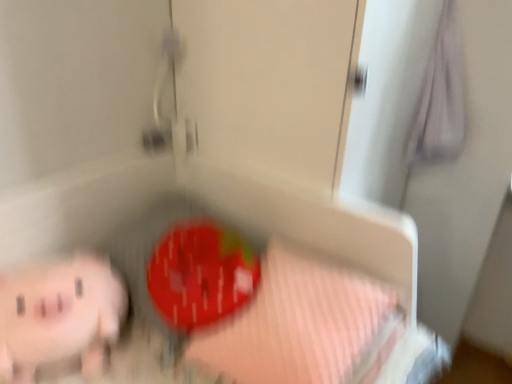
Measure the distance between pink striped fabric at lower center and camera.

pink striped fabric at lower center and camera are 31.44 inches apart from each other.

Describe the element at coordinates (304, 326) in the screenshot. I see `pink striped fabric at lower center` at that location.

Where is `pink striped fabric at lower center`? This screenshot has height=384, width=512. pink striped fabric at lower center is located at coordinates (304, 326).

What is the approximate width of pink striped fabric at lower center?

The width of pink striped fabric at lower center is 42.61 centimeters.

This screenshot has width=512, height=384. Describe the element at coordinates (59, 315) in the screenshot. I see `pink rubber piggy bank at lower left` at that location.

At what (x,y) coordinates should I click in order to perform the action: click on pink rubber piggy bank at lower left. Please return your answer as a coordinate pair (x, y). This screenshot has width=512, height=384. Looking at the image, I should click on (59, 315).

Identify the location of pink striped fabric at lower center. (304, 326).

Between pink striped fabric at lower center and pink rubber piggy bank at lower left, which one appears on the left side from the viewer's perspective?

From the viewer's perspective, pink rubber piggy bank at lower left appears more on the left side.

Which object is further away from the camera taking this photo, pink striped fabric at lower center or pink rubber piggy bank at lower left?

pink rubber piggy bank at lower left is further from the camera.

Which is closer, [378,330] or [88,277]?

The point [378,330] is in front.

From the image's perspective, which one is positioned higher, pink striped fabric at lower center or pink rubber piggy bank at lower left?

From the image's view, pink striped fabric at lower center is above.

From a real-world perspective, is pink striped fabric at lower center on pink rubber piggy bank at lower left?

Yes.

Between pink striped fabric at lower center and pink rubber piggy bank at lower left, which one has smaller width?

pink rubber piggy bank at lower left is thinner.

Considering the sizes of pink striped fabric at lower center and pink rubber piggy bank at lower left in the image, is pink striped fabric at lower center taller or shorter than pink rubber piggy bank at lower left?

In the image, pink striped fabric at lower center appears to be taller than pink rubber piggy bank at lower left.

Is pink striped fabric at lower center bigger or smaller than pink rubber piggy bank at lower left?

In the image, pink striped fabric at lower center appears to be larger than pink rubber piggy bank at lower left.

Is pink striped fabric at lower center inside the boundaries of pink rubber piggy bank at lower left, or outside?

pink striped fabric at lower center is located beyond the bounds of pink rubber piggy bank at lower left.

Is pink striped fabric at lower center in contact with pink rubber piggy bank at lower left?

No, pink striped fabric at lower center is not next to pink rubber piggy bank at lower left.

Is pink striped fabric at lower center aimed at pink rubber piggy bank at lower left?

No, pink striped fabric at lower center is not facing towards pink rubber piggy bank at lower left.

How different are the orientations of pink striped fabric at lower center and pink rubber piggy bank at lower left in degrees?

The angle between the facing direction of pink striped fabric at lower center and the facing direction of pink rubber piggy bank at lower left is 65.6 degrees.

Measure the distance between pink striped fabric at lower center and pink rubber piggy bank at lower left.

14.93 inches.

Find the location of a particular element. This screenshot has height=384, width=512. sheet in front of the pink rubber piggy bank at lower left is located at coordinates (304, 326).

Is pink rubber piggy bank at lower left at the right side of pink striped fabric at lower center?

Incorrect, pink rubber piggy bank at lower left is not on the right side of pink striped fabric at lower center.

Which object is further away from the camera taking this photo, pink rubber piggy bank at lower left or pink striped fabric at lower center?

pink rubber piggy bank at lower left is more distant.

Is point (65, 271) farther from camera compared to point (373, 333)?

Yes, it is.

From the image's perspective, does pink rubber piggy bank at lower left appear lower than pink striped fabric at lower center?

Yes.

From a real-world perspective, which is physically below, pink rubber piggy bank at lower left or pink striped fabric at lower center?

From a 3D spatial view, pink rubber piggy bank at lower left is below.

Considering the relative sizes of pink rubber piggy bank at lower left and pink striped fabric at lower center in the image provided, is pink rubber piggy bank at lower left wider than pink striped fabric at lower center?

In fact, pink rubber piggy bank at lower left might be narrower than pink striped fabric at lower center.

Considering the sizes of pink rubber piggy bank at lower left and pink striped fabric at lower center in the image, is pink rubber piggy bank at lower left taller or shorter than pink striped fabric at lower center?

Clearly, pink rubber piggy bank at lower left is shorter compared to pink striped fabric at lower center.

Between pink rubber piggy bank at lower left and pink striped fabric at lower center, which one has smaller size?

Smaller between the two is pink rubber piggy bank at lower left.

Is pink rubber piggy bank at lower left positioned beyond the bounds of pink striped fabric at lower center?

pink rubber piggy bank at lower left lies outside pink striped fabric at lower center's area.

Are pink rubber piggy bank at lower left and pink striped fabric at lower center far apart?

No, pink rubber piggy bank at lower left is not far away from pink striped fabric at lower center.

Could you tell me if pink rubber piggy bank at lower left is facing pink striped fabric at lower center?

No, pink rubber piggy bank at lower left is not turned towards pink striped fabric at lower center.

How different are the orientations of pink rubber piggy bank at lower left and pink striped fabric at lower center in degrees?

There is a 65.6-degree angle between the facing directions of pink rubber piggy bank at lower left and pink striped fabric at lower center.

Locate an element on the screen. sheet in front of the pink rubber piggy bank at lower left is located at coordinates tap(304, 326).

The height and width of the screenshot is (384, 512). Find the location of `toy below the pink striped fabric at lower center (from the image's perspective)`. toy below the pink striped fabric at lower center (from the image's perspective) is located at coordinates (59, 315).

Where is `sheet in front of the pink rubber piggy bank at lower left`? sheet in front of the pink rubber piggy bank at lower left is located at coordinates (304, 326).